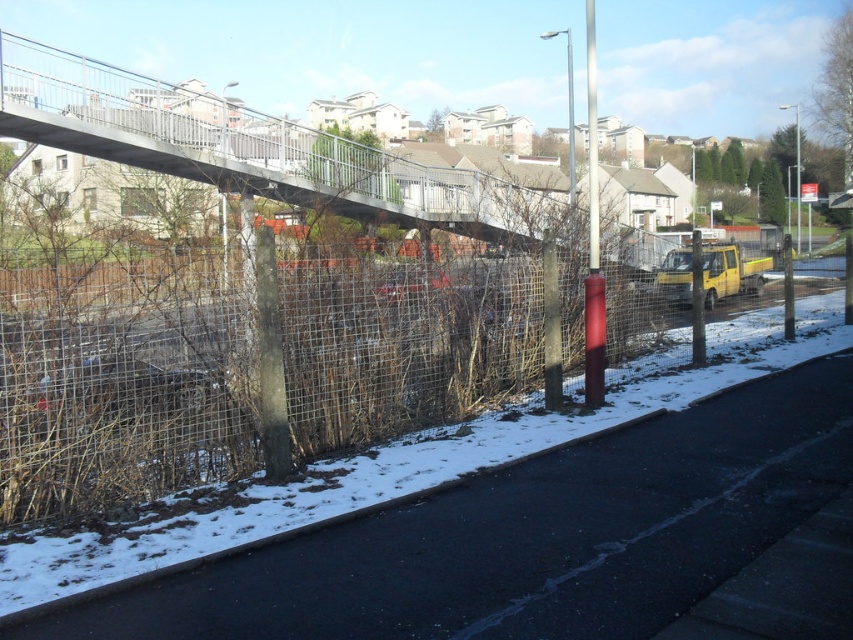
You are a delivery person standing at the wire mesh fence at lower left and need to cross the road to deliver a package. The road is 6.91 meters wide. Can you safely cross the road within 10 seconds if you walk at an average speed of 1.5 meters per second?

The road is 6.91 meters wide. At an average speed of 1.5 meters per second, it would take approximately 4.6 seconds to cross. Since 4.6 seconds is less than 10 seconds, you can safely cross the road within the time limit.

You are a delivery person trying to determine the best route to deliver packages. You notice the wire mesh fence at lower left and the smooth gray pole at center. Which object is shorter in height?

The wire mesh fence at lower left is not as tall as the smooth gray pole at center, so the wire mesh fence at lower left is shorter in height.